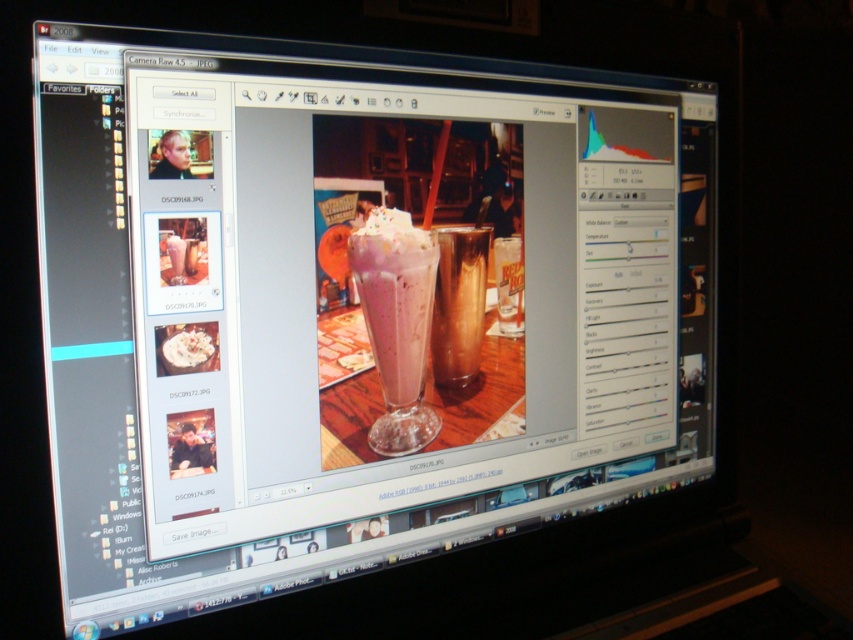
Question: Which point is farther to the camera?

Choices:
 (A) pink frosted glass at center
 (B) brown glass at center

Answer: (B)

Question: Can you confirm if pink frosted glass at center is wider than brown glass at center?

Choices:
 (A) no
 (B) yes

Answer: (B)

Question: Is pink frosted glass at center bigger than brown glass at center?

Choices:
 (A) yes
 (B) no

Answer: (A)

Question: Which point is closer to the camera?

Choices:
 (A) (440, 353)
 (B) (413, 406)

Answer: (B)

Question: Can you confirm if pink frosted glass at center is positioned above brown glass at center?

Choices:
 (A) no
 (B) yes

Answer: (A)